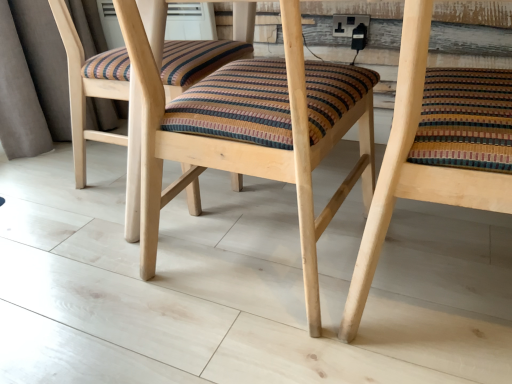
Question: Is wooden chair at center, which appears as the 2th chair when viewed from the left, inside the boundaries of wooden chair at center, the second chair positioned from the right, or outside?

Choices:
 (A) inside
 (B) outside

Answer: (B)

Question: Is wooden chair at center, the first chair in the right-to-left sequence, to the left or to the right of wooden chair at center, the 1th chair viewed from the left, in the image?

Choices:
 (A) right
 (B) left

Answer: (A)

Question: From a real-world perspective, is wooden chair at center, the first chair in the right-to-left sequence, physically located above or below wooden chair at center, the second chair positioned from the right?

Choices:
 (A) below
 (B) above

Answer: (A)

Question: Relative to wooden chair at center, the first chair in the right-to-left sequence, is wooden chair at center, the second chair positioned from the right, in front or behind?

Choices:
 (A) front
 (B) behind

Answer: (B)

Question: Is point pos(309,231) positioned closer to the camera than point pos(386,152)?

Choices:
 (A) closer
 (B) farther

Answer: (B)

Question: Based on their sizes in the image, would you say wooden chair at center, the second chair positioned from the right, is bigger or smaller than wooden chair at center, which appears as the 2th chair when viewed from the left?

Choices:
 (A) small
 (B) big

Answer: (B)

Question: From their relative heights in the image, would you say wooden chair at center, the 1th chair viewed from the left, is taller or shorter than wooden chair at center, the first chair in the right-to-left sequence?

Choices:
 (A) short
 (B) tall

Answer: (B)